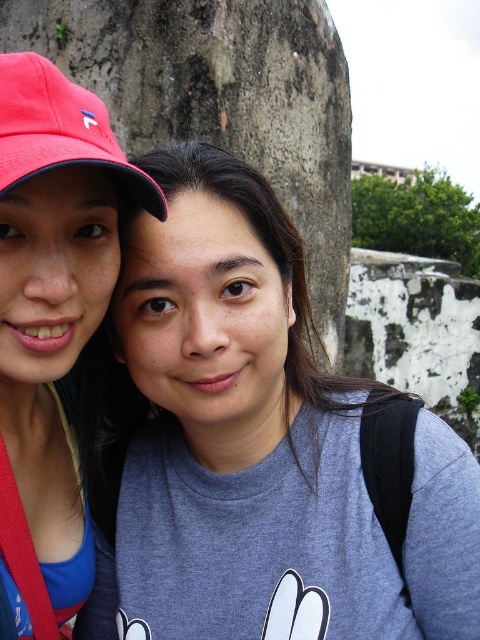
Question: Is matte pink cap at left bigger than matte red baseball cap at upper left?

Choices:
 (A) yes
 (B) no

Answer: (A)

Question: Which point is closer to the camera taking this photo?

Choices:
 (A) (106, 547)
 (B) (75, 589)
 (C) (48, 108)

Answer: (C)

Question: Considering the relative positions of gray matte t-shirt at center and matte red baseball cap at upper left in the image provided, where is gray matte t-shirt at center located with respect to matte red baseball cap at upper left?

Choices:
 (A) right
 (B) left

Answer: (A)

Question: Is matte pink cap at left smaller than matte red baseball cap at upper left?

Choices:
 (A) no
 (B) yes

Answer: (A)

Question: Which object is farther from the camera taking this photo?

Choices:
 (A) gray matte t-shirt at center
 (B) matte pink cap at left

Answer: (A)

Question: Which of the following is the closest to the observer?

Choices:
 (A) matte red baseball cap at upper left
 (B) matte pink cap at left

Answer: (A)